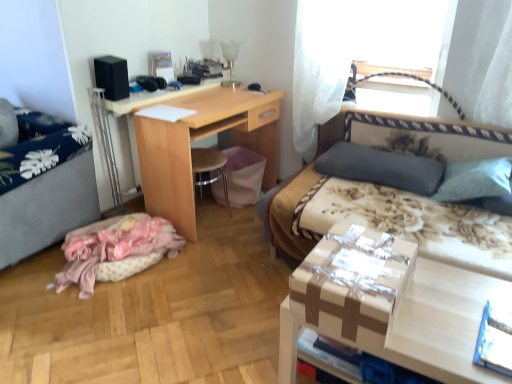
In order to click on free spot to the right of matte brown cardboard box at center in this screenshot , I will do `click(447, 306)`.